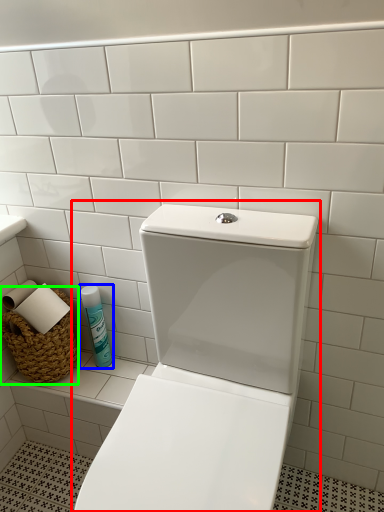
Question: Which object is the farthest from toilet (highlighted by a red box)? Choose among these: cleaning product (highlighted by a blue box) or basket (highlighted by a green box).

Choices:
 (A) cleaning product
 (B) basket

Answer: (B)